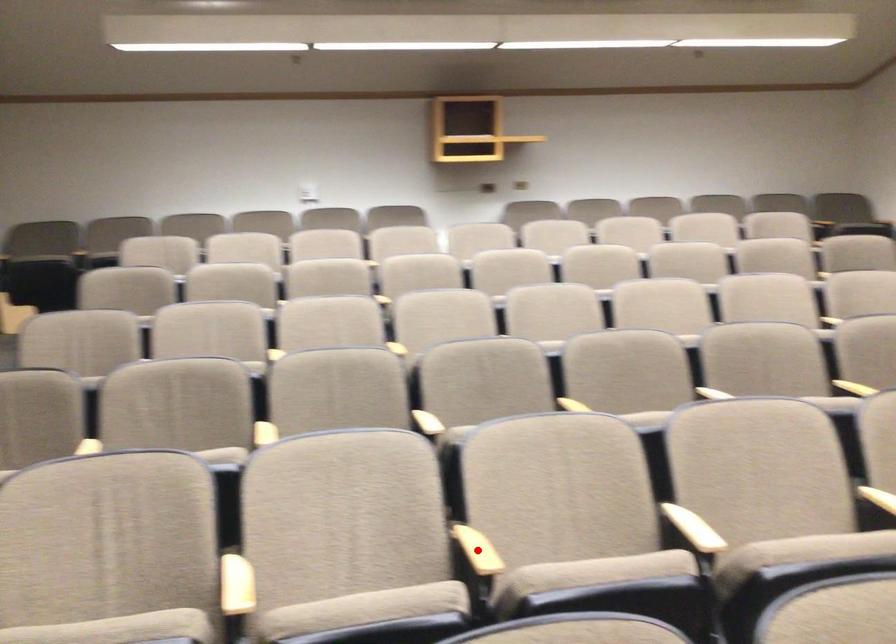
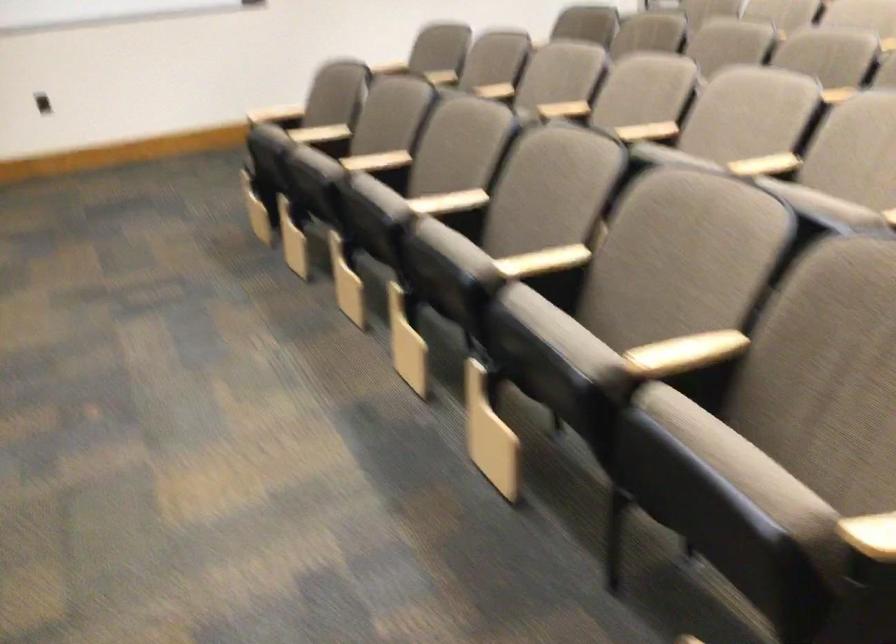
Question: I am providing you with two images of the same scene from different viewpoints. A red point is marked on the first image. Is the red point's position out of view in image 2?

Choices:
 (A) Yes
 (B) No

Answer: (A)